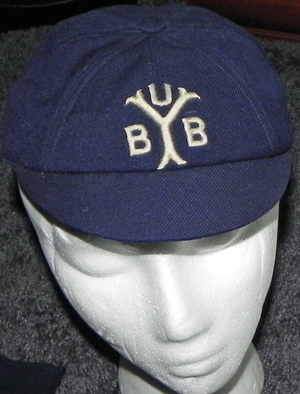
Identify the location of rounded back of stryofoam wig head. (258, 374), (249, 388), (133, 382).